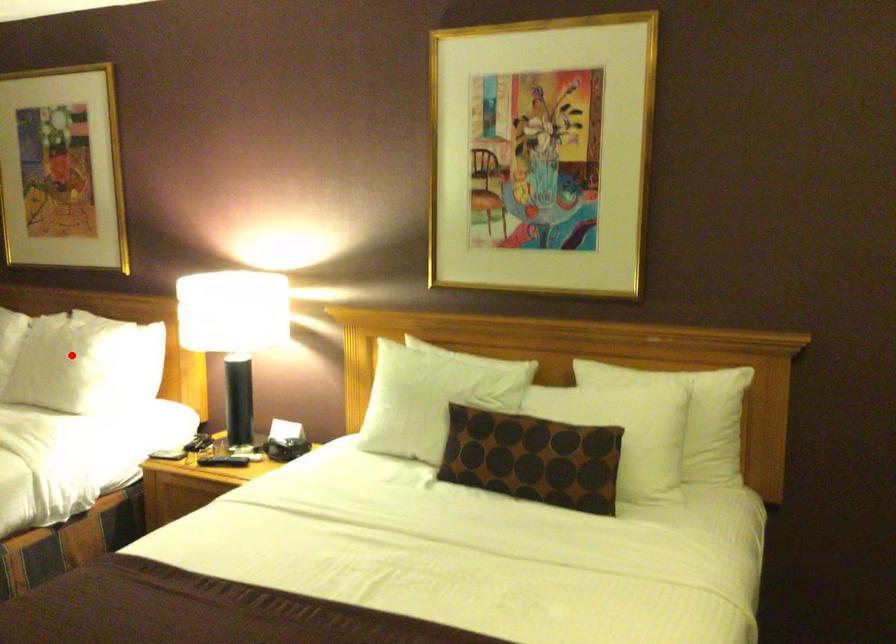
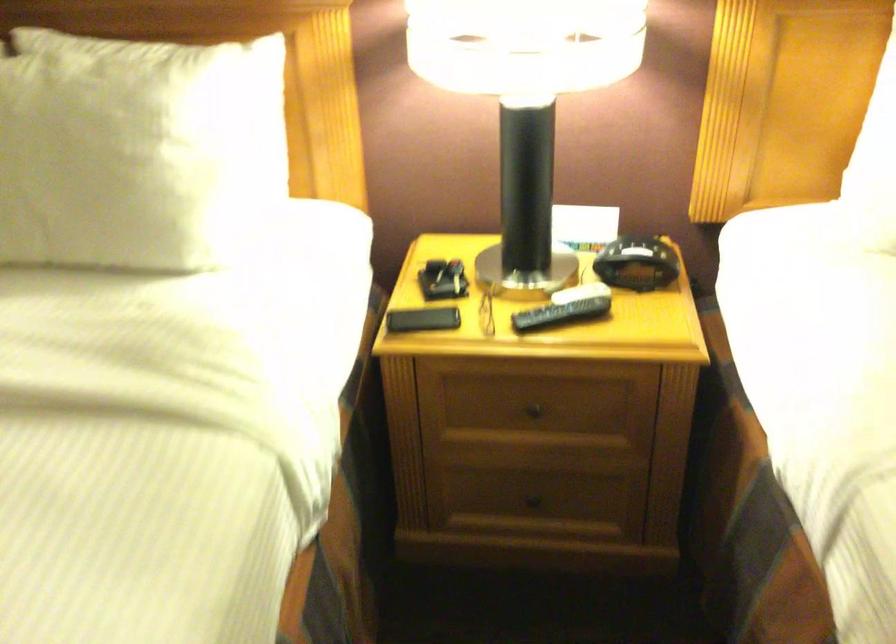
In the second image, find the point that corresponds to the highlighted location in the first image.

(134, 149)